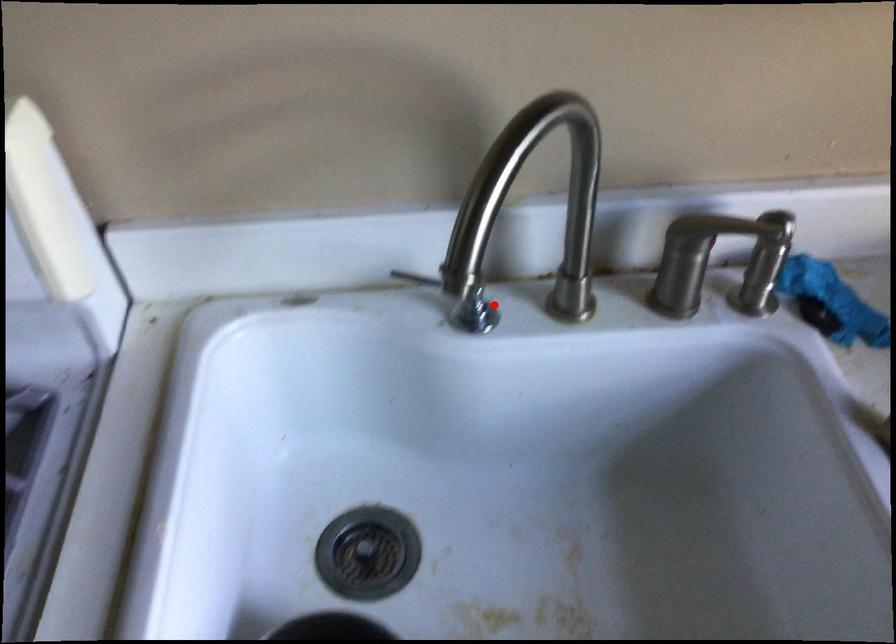
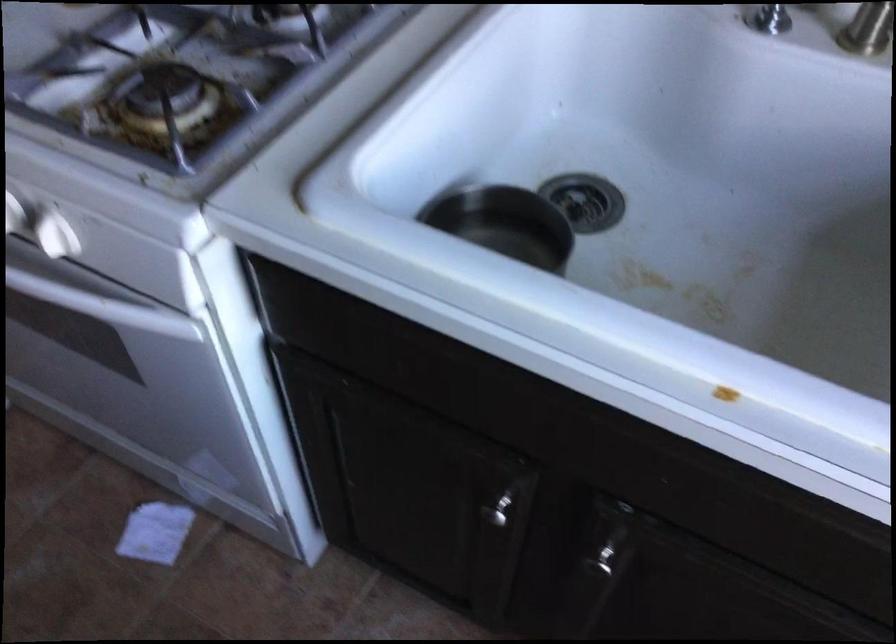
The point at the highlighted location is marked in the first image. Where is the corresponding point in the second image?

(787, 15)